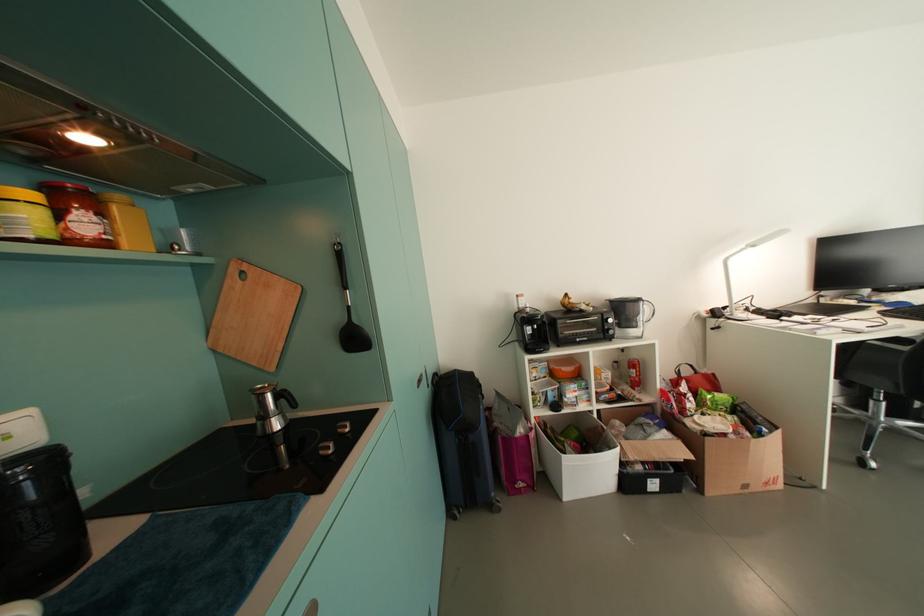
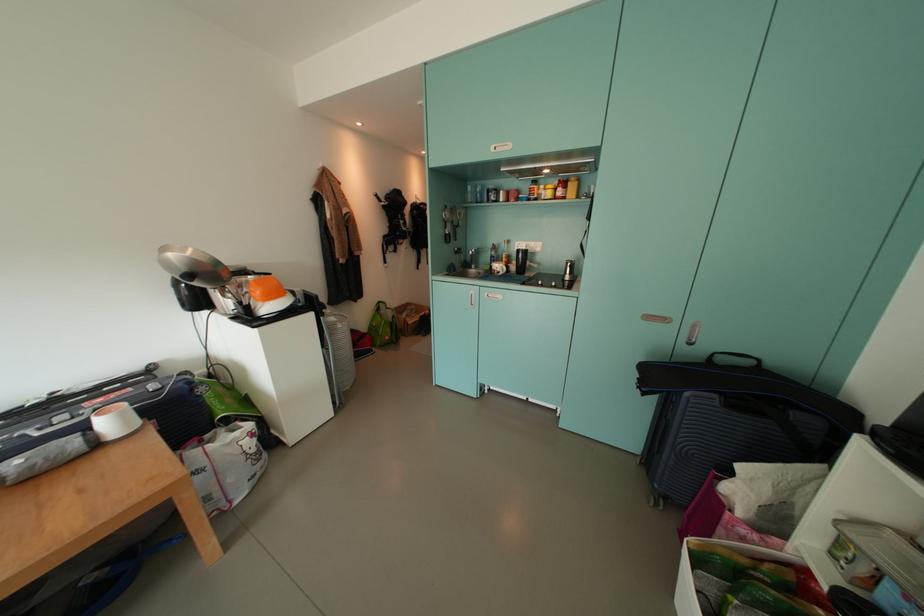
The point at (93,228) is marked in the first image. Where is the corresponding point in the second image?

(566, 195)